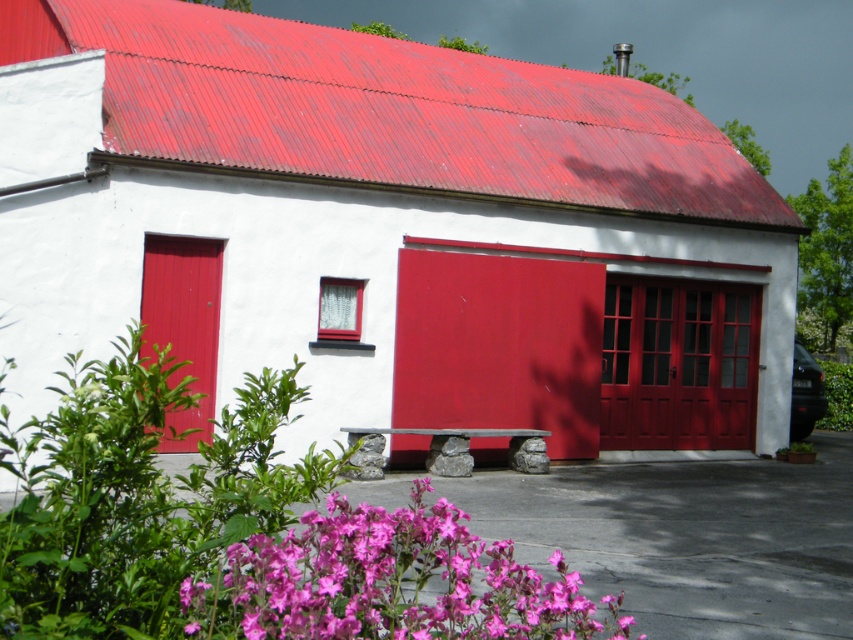
You are a visitor approaching the building and want to sit on the stone bench while keeping an eye on the entrance. Which object, the matte red door at center or the pink matte flowers at lower center, would you need to look past to see the other?

The matte red door at center occupies less space than the pink matte flowers at lower center, so you would need to look past the pink matte flowers at lower center to see the matte red door at center.